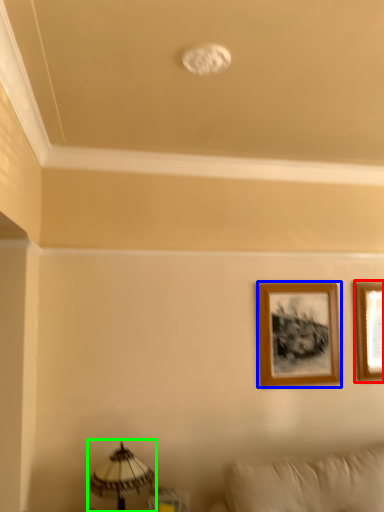
Question: Which is nearer to the picture frame (highlighted by a red box)? picture frame (highlighted by a blue box) or table lamp (highlighted by a green box).

Choices:
 (A) picture frame
 (B) table lamp

Answer: (A)